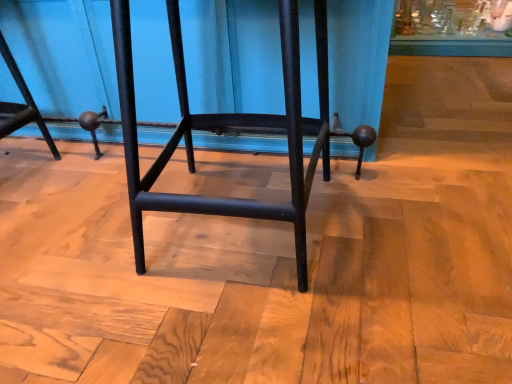
Find the location of a particular element. The width and height of the screenshot is (512, 384). vacant location below black matte metal chair at center (from a real-world perspective) is located at coordinates (241, 231).